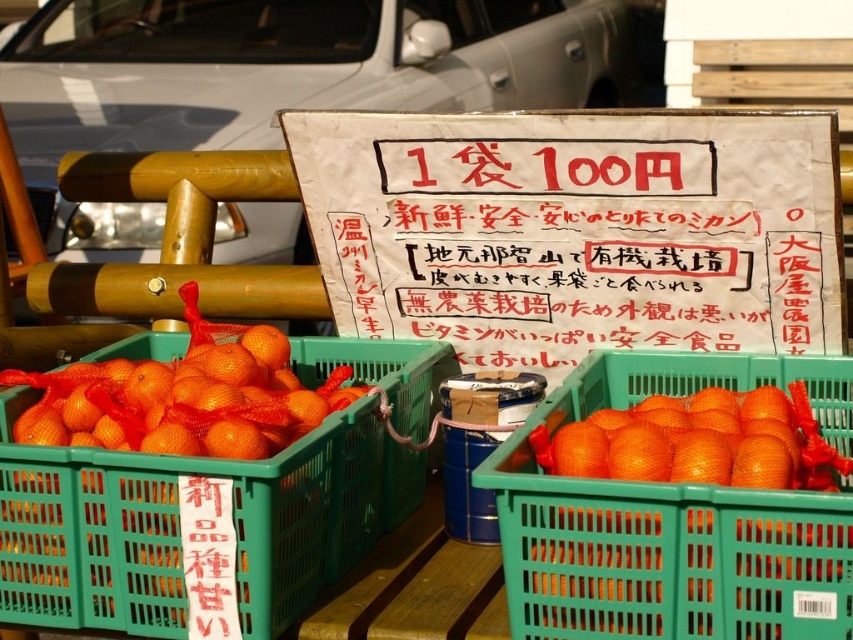
Can you confirm if orange mesh bag at center is thinner than orange mesh basket at center?

In fact, orange mesh bag at center might be wider than orange mesh basket at center.

Can you confirm if orange mesh bag at center is positioned to the left of orange mesh basket at center?

Indeed, orange mesh bag at center is positioned on the left side of orange mesh basket at center.

What are the coordinates of `orange mesh bag at center` in the screenshot? It's located at pos(178,524).